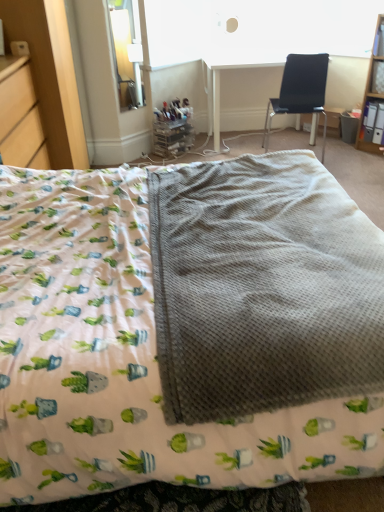
Question: Can you confirm if wooden shelf at upper right is taller than gray waffle-textured blanket at center?

Choices:
 (A) yes
 (B) no

Answer: (A)

Question: Are wooden shelf at upper right and gray waffle-textured blanket at center making contact?

Choices:
 (A) yes
 (B) no

Answer: (B)

Question: Is wooden shelf at upper right thinner than gray waffle-textured blanket at center?

Choices:
 (A) yes
 (B) no

Answer: (A)

Question: Is wooden shelf at upper right not within gray waffle-textured blanket at center?

Choices:
 (A) no
 (B) yes

Answer: (B)

Question: Are wooden shelf at upper right and gray waffle-textured blanket at center located far from each other?

Choices:
 (A) no
 (B) yes

Answer: (B)

Question: Is wooden shelf at upper right in front of gray waffle-textured blanket at center?

Choices:
 (A) yes
 (B) no

Answer: (B)

Question: Does white plastic table at upper center appear on the left side of wooden shelf at upper right?

Choices:
 (A) no
 (B) yes

Answer: (B)

Question: Does white plastic table at upper center have a greater height compared to wooden shelf at upper right?

Choices:
 (A) no
 (B) yes

Answer: (A)

Question: Can you confirm if white plastic table at upper center is thinner than wooden shelf at upper right?

Choices:
 (A) yes
 (B) no

Answer: (B)

Question: Does white plastic table at upper center turn towards wooden shelf at upper right?

Choices:
 (A) yes
 (B) no

Answer: (B)

Question: Is white plastic table at upper center further to the viewer compared to wooden shelf at upper right?

Choices:
 (A) yes
 (B) no

Answer: (A)

Question: Is white plastic table at upper center with wooden shelf at upper right?

Choices:
 (A) no
 (B) yes

Answer: (A)

Question: Considering the relative sizes of white plastic table at upper center and clear glass window screen at upper left in the image provided, is white plastic table at upper center wider than clear glass window screen at upper left?

Choices:
 (A) yes
 (B) no

Answer: (A)